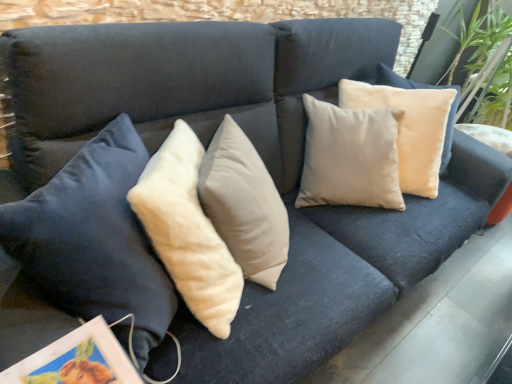
Question: Is green velvety plant at upper right bigger or smaller than matte white picture frame at lower left?

Choices:
 (A) big
 (B) small

Answer: (A)

Question: Choose the correct answer: Is green velvety plant at upper right inside matte white picture frame at lower left or outside it?

Choices:
 (A) outside
 (B) inside

Answer: (A)

Question: Is green velvety plant at upper right taller or shorter than matte white picture frame at lower left?

Choices:
 (A) short
 (B) tall

Answer: (B)

Question: Do you think matte white picture frame at lower left is within green velvety plant at upper right, or outside of it?

Choices:
 (A) outside
 (B) inside

Answer: (A)

Question: Considering the positions of matte white picture frame at lower left and green velvety plant at upper right in the image, is matte white picture frame at lower left wider or thinner than green velvety plant at upper right?

Choices:
 (A) thin
 (B) wide

Answer: (A)

Question: Relative to green velvety plant at upper right, is matte white picture frame at lower left in front or behind?

Choices:
 (A) front
 (B) behind

Answer: (A)

Question: In terms of size, does matte white picture frame at lower left appear bigger or smaller than green velvety plant at upper right?

Choices:
 (A) big
 (B) small

Answer: (B)